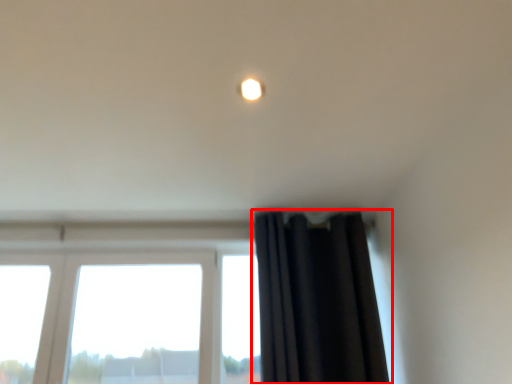
Question: From the image's perspective, what is the correct spatial positioning of curtain (annotated by the red box) in reference to lighting?

Choices:
 (A) above
 (B) below

Answer: (B)